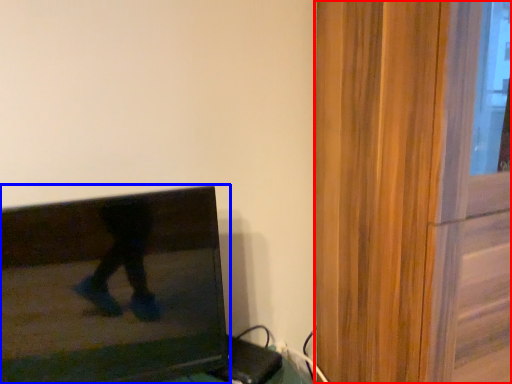
Question: Which of the following is the farthest to the observer, screen door (highlighted by a red box) or television (highlighted by a blue box)?

Choices:
 (A) screen door
 (B) television

Answer: (B)